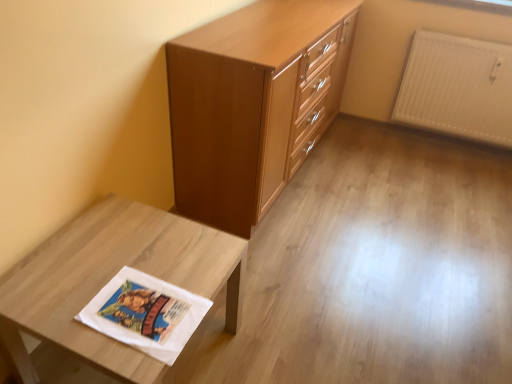
Identify the location of vacant space in front of matte wood chest of drawers at center. Image resolution: width=512 pixels, height=384 pixels. (349, 274).